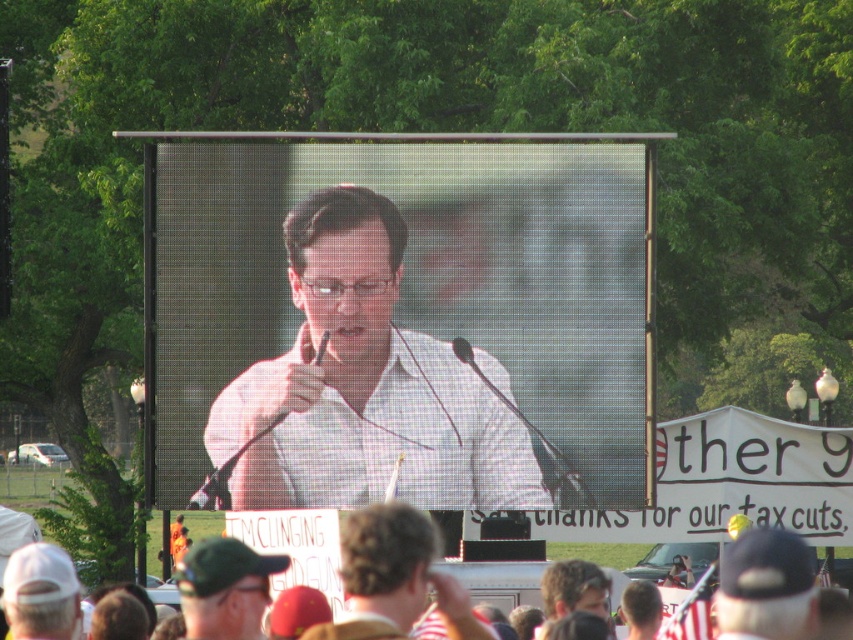
Does green cap at center have a lesser width compared to smooth brown hair at center?

No, green cap at center is not thinner than smooth brown hair at center.

Between green cap at center and smooth brown hair at center, which one has more height?

Standing taller between the two is green cap at center.

Locate an element on the screen. green cap at center is located at coordinates (225, 588).

Find the location of a particular element. The width and height of the screenshot is (853, 640). green cap at center is located at coordinates (225, 588).

Who is shorter, white checkered shirt at center or smooth brown hair at center?

Standing shorter between the two is smooth brown hair at center.

Does point (405, 481) come behind point (579, 573)?

Yes, it is.

Where is `white checkered shirt at center`? This screenshot has width=853, height=640. white checkered shirt at center is located at coordinates (367, 387).

Is brown hair at center positioned in front of green cap at center?

Yes, brown hair at center is in front of green cap at center.

Does brown hair at center have a lesser width compared to green cap at center?

Correct, brown hair at center's width is less than green cap at center's.

Which is behind, point (409, 624) or point (234, 618)?

Positioned behind is point (234, 618).

You are a GUI agent. You are given a task and a screenshot of the screen. Output one action in this format:
    pyautogui.click(x=<x>, y=<y>)
    Task: Click on the brown hair at center
    This screenshot has width=853, height=640.
    Given the screenshot: What is the action you would take?
    pyautogui.click(x=393, y=579)